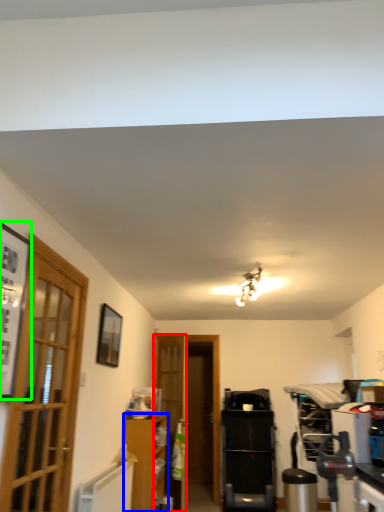
Question: Based on their relative distances, which object is farther from door (highlighted by a red box)? Choose from cabinetry (highlighted by a blue box) and picture frame (highlighted by a green box).

Choices:
 (A) cabinetry
 (B) picture frame

Answer: (B)